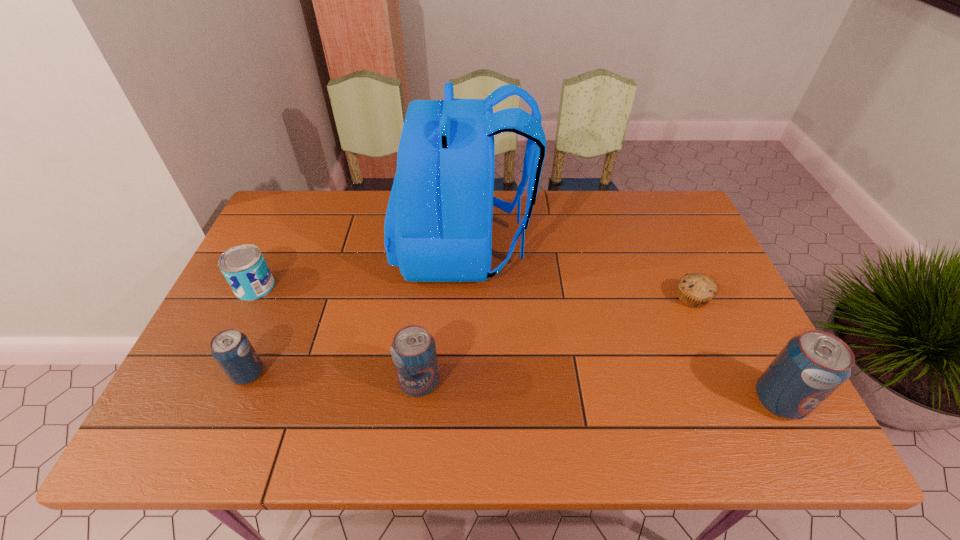
To make them evenly spaced by inserting another pop_(soda) among them, please locate a free space for this new pop_(soda). Please provide its 2D coordinates. Your answer should be formatted as a tuple, i.e. [(x, y)], where the tuple contains the x and y coordinates of a point satisfying the conditions above.

[(596, 391)]